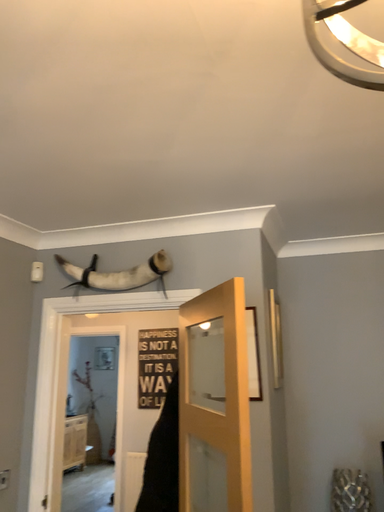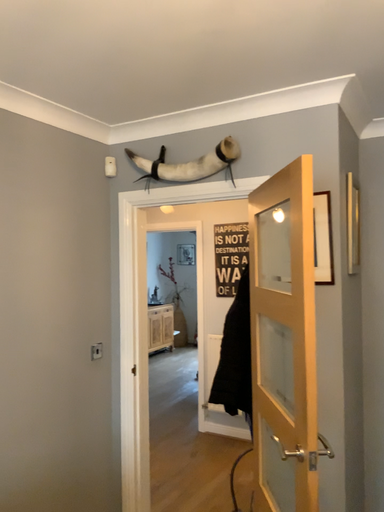
Question: How did the camera likely rotate when shooting the video?

Choices:
 (A) rotated left
 (B) rotated right

Answer: (A)